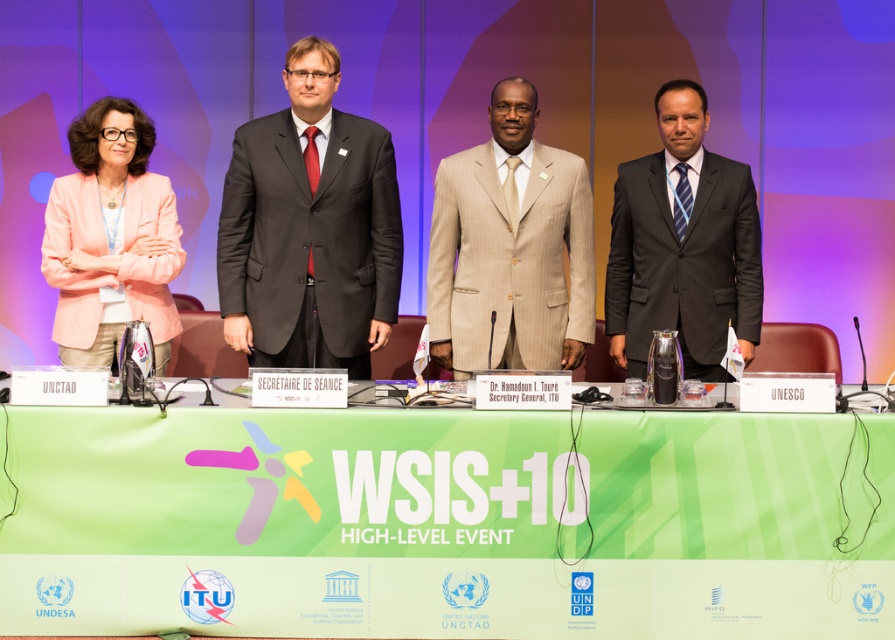
You are organizing a photo shoot for a fashion magazine and need to arrange two models wearing the beige pinstripe suit at center and the matte black suit at right. The photo requires the shorter model to stand in front so they are fully visible. Which suit should be placed in front?

The beige pinstripe suit at center should be placed in front because it is shorter than the matte black suit at right, allowing both models to be fully visible in the photo.

Looking at this image, you are at the event and want to approach the person wearing the matte black suit at center. What are the coordinates to locate them?

The coordinates for the matte black suit at center are 0.358 on the x axis and 0.346 on the y axis.

You are attending the WSIS conference and need to approach the person in the beige pinstripe suit at center and the person in the matte black suit at right. Which person should you approach first to reach them in the shortest distance?

You should approach the beige pinstripe suit at center first because it is closer to you than the matte black suit at right.